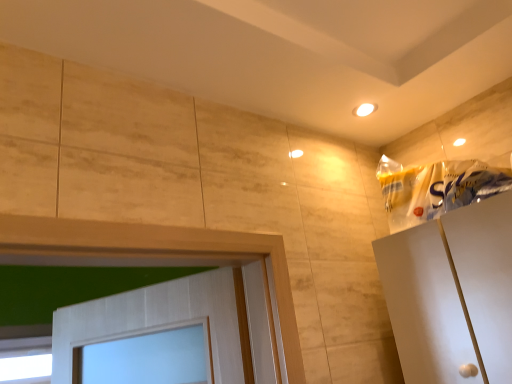
Question: Considering the positions of transparent glass window at lower left and translucent plastic bag at upper right in the image, is transparent glass window at lower left wider or thinner than translucent plastic bag at upper right?

Choices:
 (A) wide
 (B) thin

Answer: (B)

Question: In the image, is transparent glass window at lower left positioned in front of or behind translucent plastic bag at upper right?

Choices:
 (A) front
 (B) behind

Answer: (B)

Question: Is transparent glass window at lower left situated inside translucent plastic bag at upper right or outside?

Choices:
 (A) inside
 (B) outside

Answer: (B)

Question: In terms of width, does translucent plastic bag at upper right look wider or thinner when compared to transparent glass window at lower left?

Choices:
 (A) wide
 (B) thin

Answer: (A)

Question: In terms of height, does translucent plastic bag at upper right look taller or shorter compared to transparent glass window at lower left?

Choices:
 (A) short
 (B) tall

Answer: (A)

Question: Is point (438, 173) closer or farther from the camera than point (17, 367)?

Choices:
 (A) closer
 (B) farther

Answer: (A)

Question: From the image's perspective, is translucent plastic bag at upper right positioned above or below transparent glass window at lower left?

Choices:
 (A) below
 (B) above

Answer: (B)